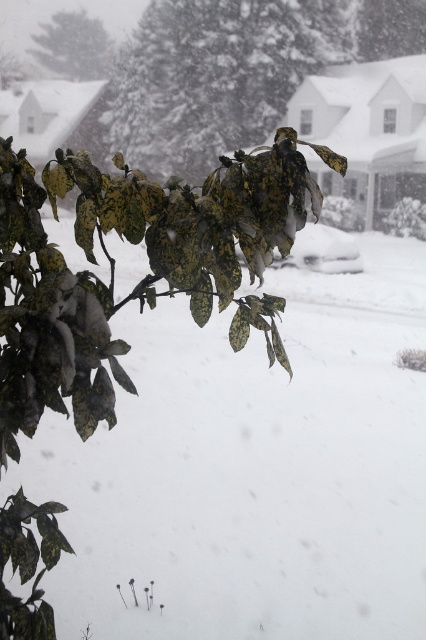
Is green matte leaves at center to the left of green leafy branch at upper left from the viewer's perspective?

No, green matte leaves at center is not to the left of green leafy branch at upper left.

Can you confirm if green matte leaves at center is positioned to the right of green leafy branch at upper left?

Indeed, green matte leaves at center is positioned on the right side of green leafy branch at upper left.

Identify the location of green matte leaves at center. The image size is (426, 640). (215, 76).